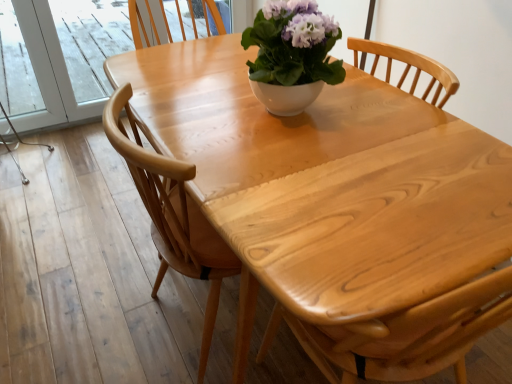
Question: Is white glossy bowl at center facing towards natural wood table at center?

Choices:
 (A) no
 (B) yes

Answer: (B)

Question: Is white glossy bowl at center turned away from natural wood table at center?

Choices:
 (A) yes
 (B) no

Answer: (B)

Question: Is natural wood table at center located within white glossy bowl at center?

Choices:
 (A) yes
 (B) no

Answer: (B)

Question: Is the position of white glossy bowl at center more distant than that of natural wood table at center?

Choices:
 (A) no
 (B) yes

Answer: (B)

Question: Considering the relative positions of white glossy bowl at center and natural wood table at center in the image provided, is white glossy bowl at center to the right of natural wood table at center from the viewer's perspective?

Choices:
 (A) no
 (B) yes

Answer: (A)

Question: Is natural wood table at center in front of or behind white glossy bowl at center in the image?

Choices:
 (A) front
 (B) behind

Answer: (A)

Question: Visually, is natural wood table at center positioned to the left or to the right of white glossy bowl at center?

Choices:
 (A) left
 (B) right

Answer: (B)

Question: From a real-world perspective, is natural wood table at center above or below white glossy bowl at center?

Choices:
 (A) below
 (B) above

Answer: (A)

Question: In terms of height, does natural wood table at center look taller or shorter compared to white glossy bowl at center?

Choices:
 (A) short
 (B) tall

Answer: (B)

Question: Considering the positions of light wood chair at center and natural wood table at center in the image, is light wood chair at center bigger or smaller than natural wood table at center?

Choices:
 (A) big
 (B) small

Answer: (B)

Question: Is light wood chair at center to the left or to the right of natural wood table at center in the image?

Choices:
 (A) right
 (B) left

Answer: (B)

Question: Is light wood chair at center spatially inside natural wood table at center, or outside of it?

Choices:
 (A) inside
 (B) outside

Answer: (B)

Question: From a real-world perspective, is light wood chair at center positioned above or below natural wood table at center?

Choices:
 (A) below
 (B) above

Answer: (A)

Question: In terms of width, does light wood chair at center look wider or thinner when compared to white glossy bowl at center?

Choices:
 (A) wide
 (B) thin

Answer: (A)

Question: From a real-world perspective, is light wood chair at center physically located above or below white glossy bowl at center?

Choices:
 (A) below
 (B) above

Answer: (A)